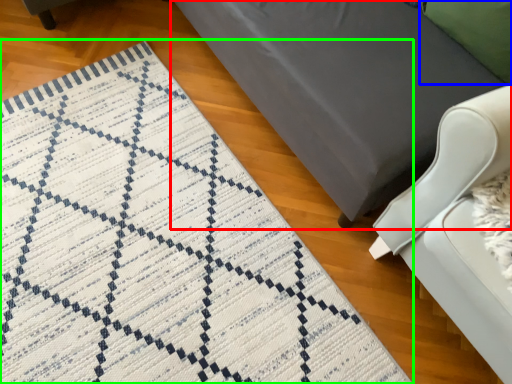
Question: Considering the real-world distances, which object is farthest from furniture (highlighted by a red box)? pillow (highlighted by a blue box) or mat (highlighted by a green box)?

Choices:
 (A) pillow
 (B) mat

Answer: (B)